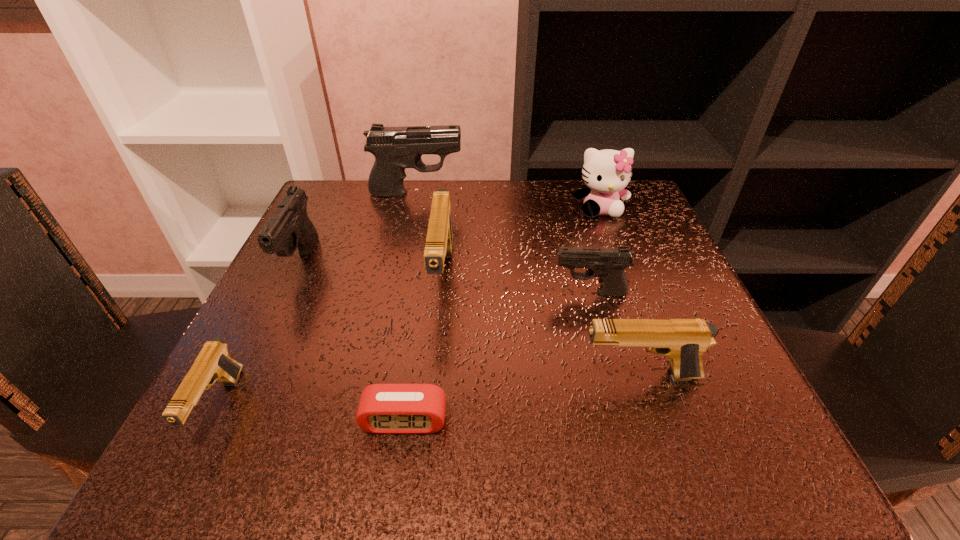
Find the location of `the biggest black pistol`. the biggest black pistol is located at coordinates (395, 148).

The image size is (960, 540). I want to click on the farthest black pistol, so click(395, 148).

This screenshot has height=540, width=960. Identify the location of kitten. pos(607,172).

The height and width of the screenshot is (540, 960). What are the coordinates of `the second farthest object` in the screenshot? It's located at (607, 172).

Image resolution: width=960 pixels, height=540 pixels. Identify the location of the biggest tan pistol. (439, 240).

This screenshot has height=540, width=960. I want to click on the farthest tan pistol, so click(439, 240).

Image resolution: width=960 pixels, height=540 pixels. I want to click on the leftmost black pistol, so click(290, 228).

Locate an element on the screen. The width and height of the screenshot is (960, 540). the rightmost tan pistol is located at coordinates (684, 341).

The width and height of the screenshot is (960, 540). I want to click on the rightmost black pistol, so click(x=608, y=264).

I want to click on the smallest tan pistol, so click(x=213, y=363).